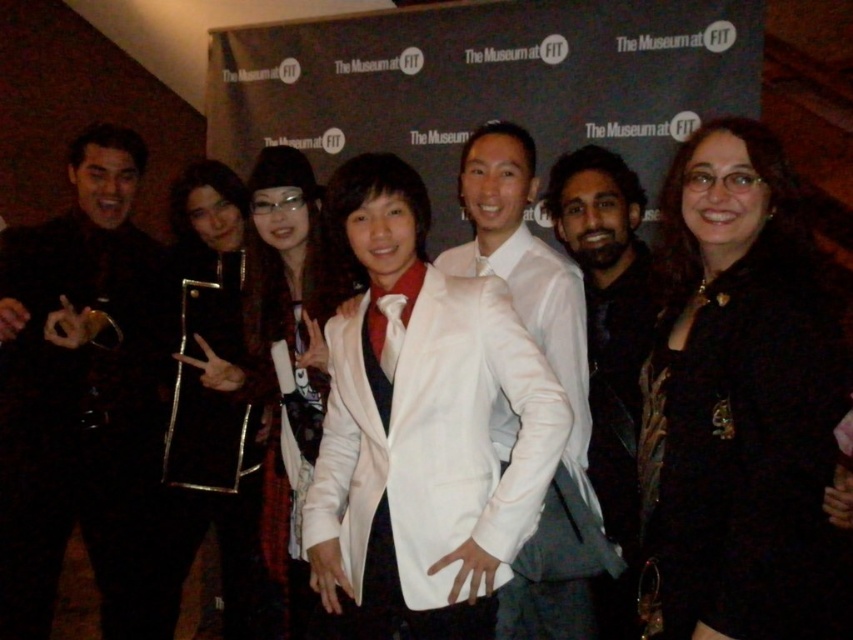
Can you confirm if white satin suit at center is positioned to the left of dark brown leather jacket at center?

Correct, you'll find white satin suit at center to the left of dark brown leather jacket at center.

Which is below, white satin suit at center or dark brown leather jacket at center?

dark brown leather jacket at center is below.

Does point (566, 566) lie behind point (563, 184)?

No, it is not.

Where is `white satin suit at center`? The width and height of the screenshot is (853, 640). white satin suit at center is located at coordinates (554, 372).

Who is higher up, black velvet dress at center or dark brown leather jacket at center?

black velvet dress at center is above.

The image size is (853, 640). I want to click on black velvet dress at center, so pos(740,406).

Who is more forward, (815, 470) or (621, 198)?

Point (815, 470)

Locate an element on the screen. Image resolution: width=853 pixels, height=640 pixels. black velvet dress at center is located at coordinates (740, 406).

Who is taller, black textured suit at left or white satin blazer at center?

black textured suit at left

Who is more distant from viewer, (10,580) or (321,486)?

Point (10,580)

Locate an element on the screen. The image size is (853, 640). black textured suit at left is located at coordinates (76, 387).